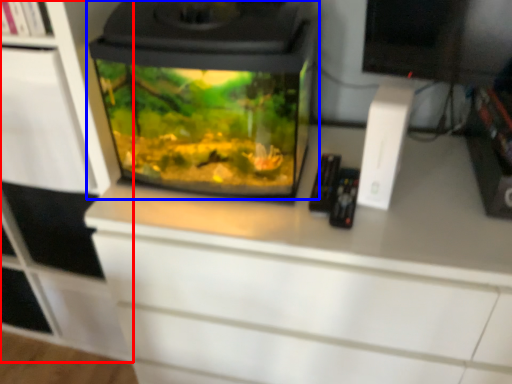
Question: Which object is closer to the camera taking this photo, cabinetry (highlighted by a red box) or home appliance (highlighted by a blue box)?

Choices:
 (A) cabinetry
 (B) home appliance

Answer: (B)